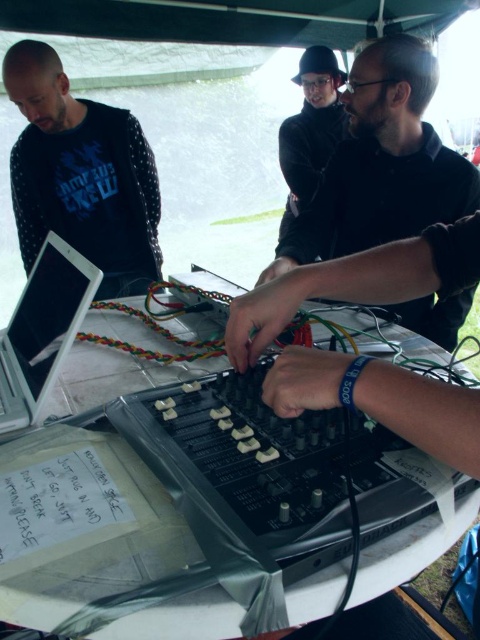
Is black dotted sweatshirt at upper left bigger than white glossy laptop at center?

Indeed, black dotted sweatshirt at upper left has a larger size compared to white glossy laptop at center.

Does black dotted sweatshirt at upper left appear on the left side of white glossy laptop at center?

Correct, you'll find black dotted sweatshirt at upper left to the left of white glossy laptop at center.

At what (x,y) coordinates should I click in order to perform the action: click on black dotted sweatshirt at upper left. Please return your answer as a coordinate pair (x, y). Looking at the image, I should click on (81, 173).

You are a GUI agent. You are given a task and a screenshot of the screen. Output one action in this format:
    pyautogui.click(x=<x>, y=<y>)
    Task: Click on the black dotted sweatshirt at upper left
    This screenshot has width=480, height=640.
    Given the screenshot: What is the action you would take?
    pyautogui.click(x=81, y=173)

What do you see at coordinates (43, 330) in the screenshot? I see `white glossy laptop at center` at bounding box center [43, 330].

Who is more forward, (82, 291) or (63, 632)?

Positioned in front is point (63, 632).

You are a GUI agent. You are given a task and a screenshot of the screen. Output one action in this format:
    pyautogui.click(x=<x>, y=<y>)
    Task: Click on the white glossy laptop at center
    The image size is (480, 640).
    Given the screenshot: What is the action you would take?
    pyautogui.click(x=43, y=330)

Measure the distance from black dotted sweatshirt at upper left to white plastic table at center.

3.28 feet

Is point (93, 243) closer to viewer compared to point (414, 344)?

No, it is behind (414, 344).

Where is `black dotted sweatshirt at upper left`? The image size is (480, 640). black dotted sweatshirt at upper left is located at coordinates (81, 173).